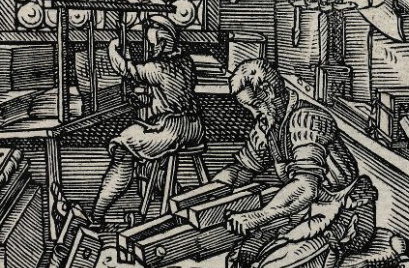
Image resolution: width=409 pixels, height=268 pixels. In order to click on shelf in this screenshot , I will do `click(35, 37)`, `click(397, 160)`.